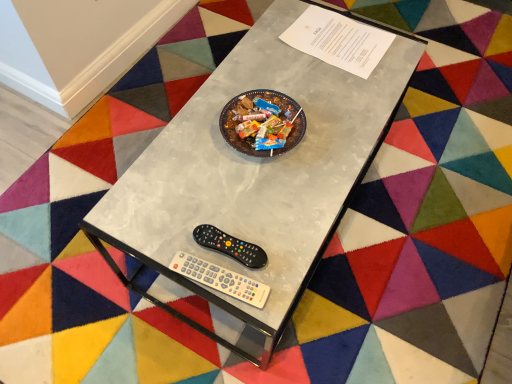
Question: From a real-world perspective, is metallic gray table at center positioned above or below black plastic remote at lower center?

Choices:
 (A) above
 (B) below

Answer: (B)

Question: Considering the positions of point (305, 147) and point (198, 238), is point (305, 147) closer or farther from the camera than point (198, 238)?

Choices:
 (A) closer
 (B) farther

Answer: (B)

Question: Which object is positioned farthest from the black plastic remote at lower center?

Choices:
 (A) white plastic wii controller at lower center
 (B) metallic gray table at center

Answer: (B)

Question: Which of these objects is positioned closest to the metallic gray table at center?

Choices:
 (A) black plastic remote at lower center
 (B) white plastic wii controller at lower center

Answer: (A)